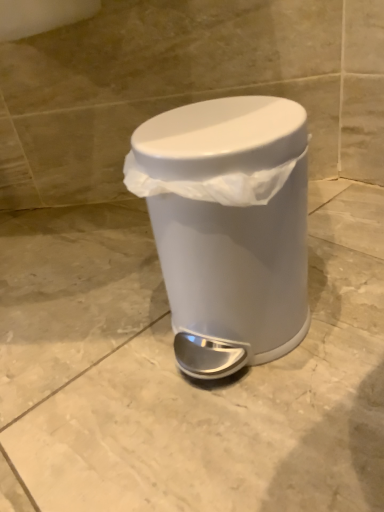
What do you see at coordinates (228, 226) in the screenshot? I see `white plastic waste container at center` at bounding box center [228, 226].

In order to face white plastic waste container at center, should I rotate leftwards or rightwards?

To face it directly, rotate right by 3.547 degrees.

Locate an element on the screen. white plastic waste container at center is located at coordinates (228, 226).

In order to click on white plastic waste container at center in this screenshot , I will do `click(228, 226)`.